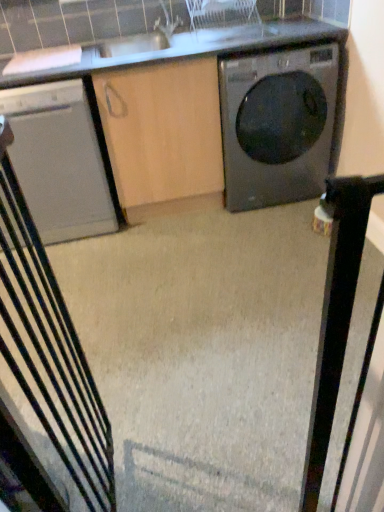
Describe the element at coordinates (49, 349) in the screenshot. I see `metallic gray rocking chair at left` at that location.

Where is `metallic gray rocking chair at left`? metallic gray rocking chair at left is located at coordinates (49, 349).

In order to click on matte black washing machine at right in this screenshot , I will do `click(277, 125)`.

This screenshot has height=512, width=384. What do you see at coordinates (144, 37) in the screenshot? I see `white glossy countertop at upper center` at bounding box center [144, 37].

Identify the location of metallic gray rocking chair at left. (49, 349).

Is metallic gray rocking chair at left smaller than matte black washing machine at right?

Indeed, metallic gray rocking chair at left has a smaller size compared to matte black washing machine at right.

How many degrees apart are the facing directions of metallic gray rocking chair at left and matte black washing machine at right?

90 degrees.

Is metallic gray rocking chair at left facing away from matte black washing machine at right?

No, metallic gray rocking chair at left is not facing the opposite direction of matte black washing machine at right.

Find the location of a particular element. rocking chair above the matte black washing machine at right (from a real-world perspective) is located at coordinates (49, 349).

You are a GUI agent. You are given a task and a screenshot of the screen. Output one action in this format:
    pyautogui.click(x=<x>, y=<y>)
    Task: Click on the home appliance behind the white glossy countertop at upper center
    
    Given the screenshot: What is the action you would take?
    pyautogui.click(x=59, y=161)

Does white glossy countertop at upper center lie behind satin white dishwasher at left?

No.

Is white glossy countertop at upper center positioned with its back to satin white dishwasher at left?

white glossy countertop at upper center does not have its back to satin white dishwasher at left.

From the image's perspective, which is below, white glossy countertop at upper center or satin white dishwasher at left?

satin white dishwasher at left is shown below in the image.

Considering the sizes of objects satin white dishwasher at left and metallic gray rocking chair at left in the image provided, who is taller, satin white dishwasher at left or metallic gray rocking chair at left?

With more height is metallic gray rocking chair at left.

Locate an element on the screen. rocking chair that appears on the right of satin white dishwasher at left is located at coordinates (49, 349).

Which is more distant, (80, 124) or (96, 410)?

The point (80, 124) is behind.

Are satin white dishwasher at left and metallic gray rocking chair at left far apart?

That's right, there is a large distance between satin white dishwasher at left and metallic gray rocking chair at left.

Considering the positions of point (45, 208) and point (117, 50), is point (45, 208) closer or farther from the camera than point (117, 50)?

Point (45, 208) is positioned closer to the camera compared to point (117, 50).

Can you confirm if satin white dishwasher at left is shorter than white glossy countertop at upper center?

Incorrect, the height of satin white dishwasher at left does not fall short of that of white glossy countertop at upper center.

From a real-world perspective, is satin white dishwasher at left beneath white glossy countertop at upper center?

Correct, in the physical world, satin white dishwasher at left is lower than white glossy countertop at upper center.

Is the position of satin white dishwasher at left more distant than that of white glossy countertop at upper center?

Yes, satin white dishwasher at left is behind white glossy countertop at upper center.

Considering the positions of objects metallic gray rocking chair at left and white glossy countertop at upper center in the image provided, who is more to the left, metallic gray rocking chair at left or white glossy countertop at upper center?

metallic gray rocking chair at left is more to the left.

In terms of height, does metallic gray rocking chair at left look taller or shorter compared to white glossy countertop at upper center?

Clearly, metallic gray rocking chair at left is taller compared to white glossy countertop at upper center.

Is metallic gray rocking chair at left far away from white glossy countertop at upper center?

metallic gray rocking chair at left is far away from white glossy countertop at upper center.

Which object is thinner, metallic gray rocking chair at left or white glossy countertop at upper center?

With smaller width is metallic gray rocking chair at left.

Where is `washing machine located behind the white glossy countertop at upper center`? This screenshot has height=512, width=384. washing machine located behind the white glossy countertop at upper center is located at coordinates (277, 125).

Consider the image. Is matte black washing machine at right turned away from white glossy countertop at upper center?

matte black washing machine at right does not have its back to white glossy countertop at upper center.

Which of these two, matte black washing machine at right or white glossy countertop at upper center, is thinner?

white glossy countertop at upper center is thinner.

Is matte black washing machine at right to the left or to the right of white glossy countertop at upper center in the image?

matte black washing machine at right is to the right of white glossy countertop at upper center.

From the image's perspective, between satin white dishwasher at left and matte black washing machine at right, which one is located above?

From the image's view, matte black washing machine at right is above.

Is satin white dishwasher at left further to camera compared to matte black washing machine at right?

No, the depth of satin white dishwasher at left is less than that of matte black washing machine at right.

Could you tell me if satin white dishwasher at left is turned towards matte black washing machine at right?

No, satin white dishwasher at left is not facing towards matte black washing machine at right.

Who is shorter, satin white dishwasher at left or matte black washing machine at right?

matte black washing machine at right is shorter.

Find the location of `rocking chair on the left of matte black washing machine at right`. rocking chair on the left of matte black washing machine at right is located at coordinates (49, 349).

In the image, there is a satin white dishwasher at left. Identify the location of countertop above it (from the image's perspective). (144, 37).

When comparing their distances from satin white dishwasher at left, does matte black washing machine at right or white glossy countertop at upper center seem closer?

white glossy countertop at upper center lies closer to satin white dishwasher at left than the other object.

Considering their positions, is matte black washing machine at right positioned closer to satin white dishwasher at left than metallic gray rocking chair at left?

matte black washing machine at right is positioned closer to the anchor satin white dishwasher at left.

When comparing their distances from white glossy countertop at upper center, does satin white dishwasher at left or metallic gray rocking chair at left seem further?

metallic gray rocking chair at left is positioned further to the anchor white glossy countertop at upper center.

Estimate the real-world distances between objects in this image. Which object is closer to white glossy countertop at upper center, metallic gray rocking chair at left or satin white dishwasher at left?

Based on the image, satin white dishwasher at left appears to be nearer to white glossy countertop at upper center.

Looking at the image, which one is located further to matte black washing machine at right, metallic gray rocking chair at left or satin white dishwasher at left?

Among the two, metallic gray rocking chair at left is located further to matte black washing machine at right.

Estimate the real-world distances between objects in this image. Which object is closer to white glossy countertop at upper center, matte black washing machine at right or metallic gray rocking chair at left?

Based on the image, matte black washing machine at right appears to be nearer to white glossy countertop at upper center.

From the image, which object appears to be nearer to matte black washing machine at right, satin white dishwasher at left or metallic gray rocking chair at left?

satin white dishwasher at left.

Looking at the image, which one is located closer to metallic gray rocking chair at left, white glossy countertop at upper center or matte black washing machine at right?

Based on the image, white glossy countertop at upper center appears to be nearer to metallic gray rocking chair at left.

This screenshot has height=512, width=384. Identify the location of countertop located between metallic gray rocking chair at left and matte black washing machine at right in the depth direction. (144, 37).

Where is `home appliance between metallic gray rocking chair at left and matte black washing machine at right in the front-back direction`? home appliance between metallic gray rocking chair at left and matte black washing machine at right in the front-back direction is located at coordinates (59, 161).

Where is `countertop positioned between metallic gray rocking chair at left and satin white dishwasher at left from near to far`? The width and height of the screenshot is (384, 512). countertop positioned between metallic gray rocking chair at left and satin white dishwasher at left from near to far is located at coordinates (144, 37).

Locate an element on the screen. This screenshot has width=384, height=512. countertop between satin white dishwasher at left and matte black washing machine at right is located at coordinates (144, 37).